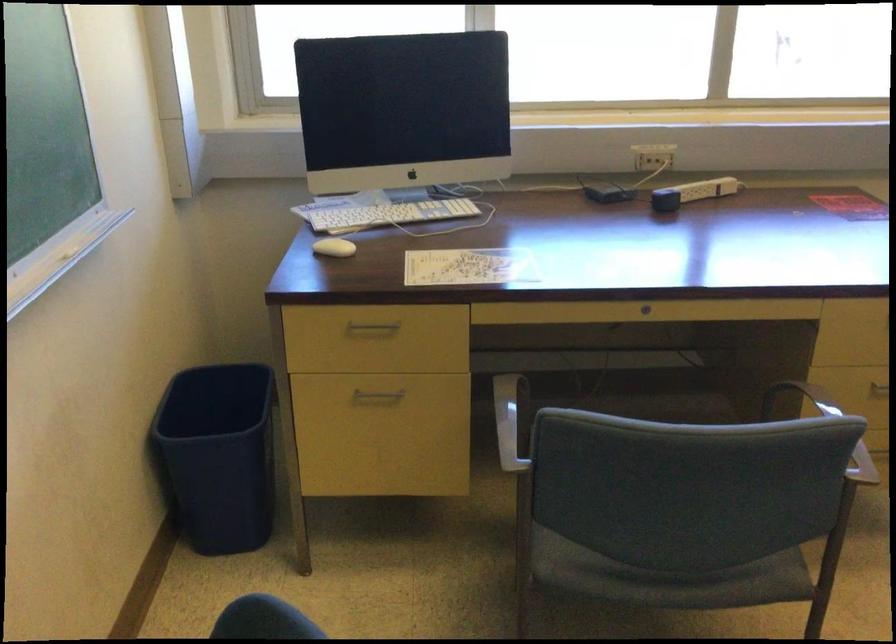
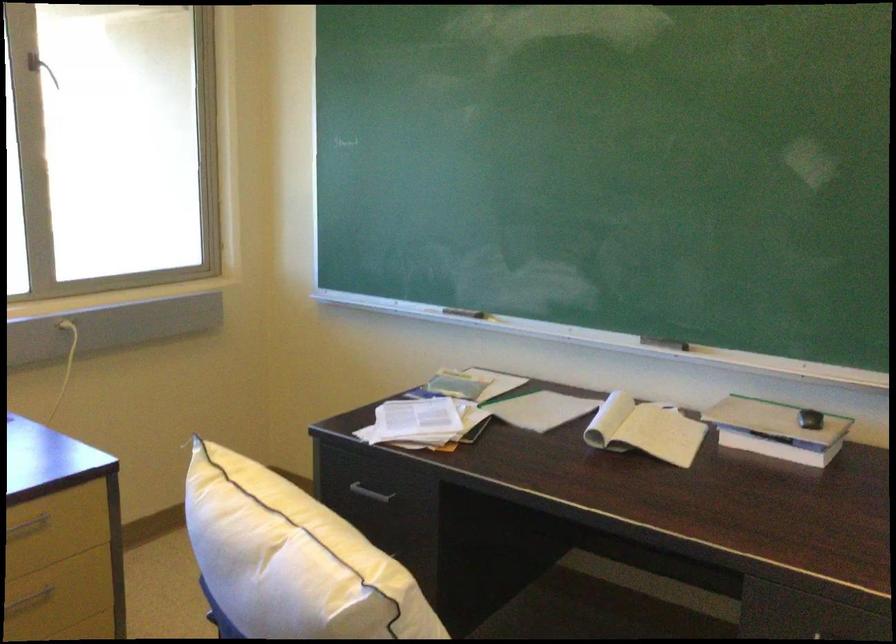
Question: The camera is either moving clockwise (left) or counter-clockwise (right) around the object. The first image is from the beginning of the video and the second image is from the end. Is the camera moving left or right when shooting the video?

Choices:
 (A) Left
 (B) Right

Answer: (A)